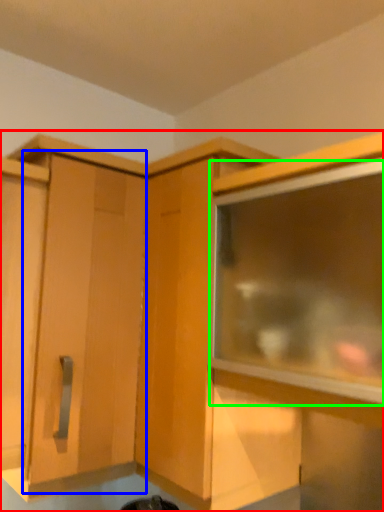
Question: Which object is the farthest from cabinetry (highlighted by a red box)? Choose among these: cabinetry (highlighted by a blue box) or window (highlighted by a green box).

Choices:
 (A) cabinetry
 (B) window

Answer: (B)